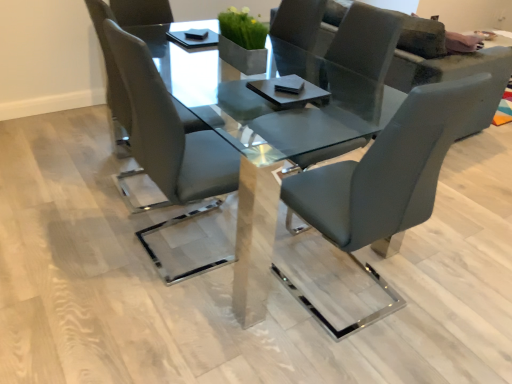
Question: Is clear glass table at center bigger or smaller than satin grey leather chair at center, marked as the 3th chair in a right-to-left arrangement?

Choices:
 (A) small
 (B) big

Answer: (B)

Question: From a real-world perspective, is clear glass table at center above or below satin grey leather chair at center, which is counted as the first chair, starting from the left?

Choices:
 (A) below
 (B) above

Answer: (A)

Question: Which object is the farthest from the clear glass table at center?

Choices:
 (A) matte gray couch at upper right
 (B) matte gray chair at center, arranged as the third chair when viewed from the left
 (C) matte gray chair at center, which appears as the 2th chair when viewed from the right
 (D) satin grey leather chair at center, which is counted as the first chair, starting from the left

Answer: (A)

Question: Which object is the closest to the matte gray chair at center, which appears as the 2th chair when viewed from the right?

Choices:
 (A) clear glass table at center
 (B) matte gray couch at upper right
 (C) satin grey leather chair at center, marked as the 3th chair in a right-to-left arrangement
 (D) matte gray chair at center, arranged as the third chair when viewed from the left

Answer: (A)